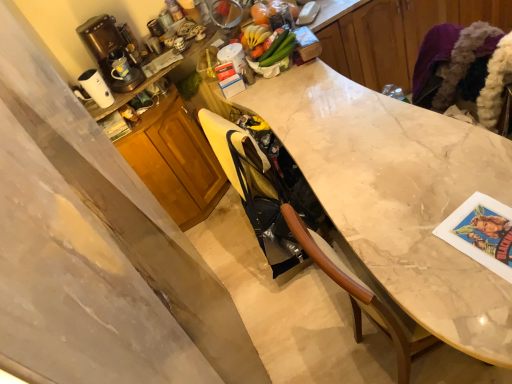
Question: Is white marble countertop at center, the second cabinetry positioned from the bottom, completely or partially inside wooden cabinet at center, positioned as the first cabinetry in left-to-right order?

Choices:
 (A) no
 (B) yes

Answer: (A)

Question: Can you confirm if wooden cabinet at center, positioned as the first cabinetry in left-to-right order, is wider than white marble countertop at center, the first cabinetry viewed from the top?

Choices:
 (A) yes
 (B) no

Answer: (B)

Question: From a real-world perspective, is wooden cabinet at center, which is the second cabinetry in right-to-left order, located higher than white marble countertop at center, the second cabinetry positioned from the bottom?

Choices:
 (A) yes
 (B) no

Answer: (B)

Question: Is wooden cabinet at center, marked as the second cabinetry in a top-to-bottom arrangement, not within white marble countertop at center, the second cabinetry positioned from the bottom?

Choices:
 (A) yes
 (B) no

Answer: (A)

Question: From the image's perspective, is wooden cabinet at center, marked as the second cabinetry in a top-to-bottom arrangement, located beneath white marble countertop at center, which appears as the 1th cabinetry when viewed from the right?

Choices:
 (A) yes
 (B) no

Answer: (A)

Question: Is wooden cabinet at center, which is the second cabinetry in right-to-left order, spatially inside marble at center, or outside of it?

Choices:
 (A) inside
 (B) outside

Answer: (B)

Question: Considering the positions of point (182, 175) and point (335, 91), is point (182, 175) closer or farther from the camera than point (335, 91)?

Choices:
 (A) farther
 (B) closer

Answer: (A)

Question: From the image's perspective, is wooden cabinet at center, which is the second cabinetry in right-to-left order, located above or below marble at center?

Choices:
 (A) below
 (B) above

Answer: (B)

Question: Is wooden cabinet at center, which is the 1th cabinetry from bottom to top, wider or thinner than marble at center?

Choices:
 (A) wide
 (B) thin

Answer: (B)

Question: Is point (349, 150) positioned closer to the camera than point (119, 39)?

Choices:
 (A) closer
 (B) farther

Answer: (A)

Question: In the image, is marble at center positioned in front of or behind brown plastic coffee machine at upper left?

Choices:
 (A) behind
 (B) front

Answer: (B)

Question: Do you think marble at center is within brown plastic coffee machine at upper left, or outside of it?

Choices:
 (A) inside
 (B) outside

Answer: (B)

Question: From the image's perspective, is marble at center located above or below brown plastic coffee machine at upper left?

Choices:
 (A) below
 (B) above

Answer: (A)

Question: Would you say white glossy electric kettle at upper left is to the left or to the right of wooden cabinet at center, positioned as the first cabinetry in left-to-right order, in the picture?

Choices:
 (A) right
 (B) left

Answer: (B)

Question: Is point (96, 94) closer or farther from the camera than point (193, 117)?

Choices:
 (A) closer
 (B) farther

Answer: (A)